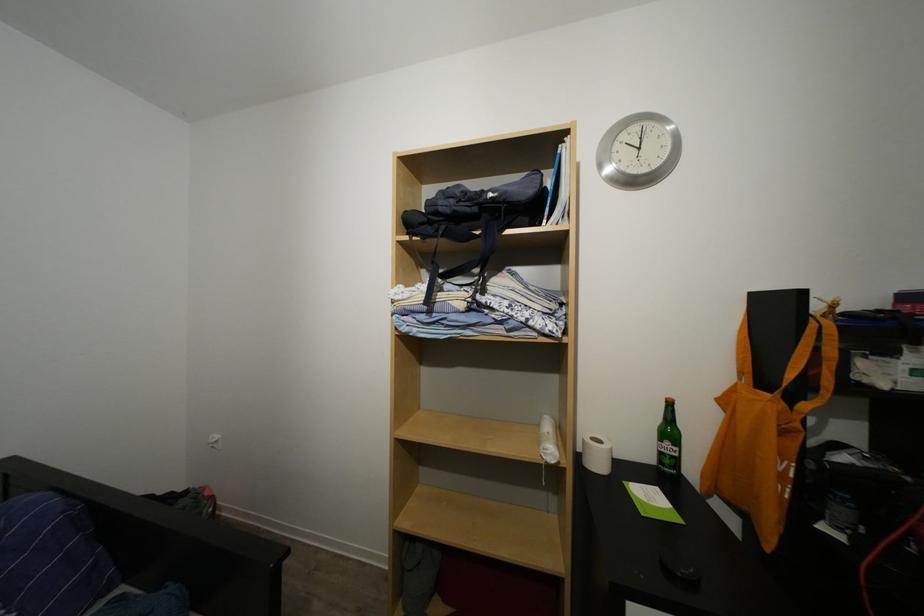
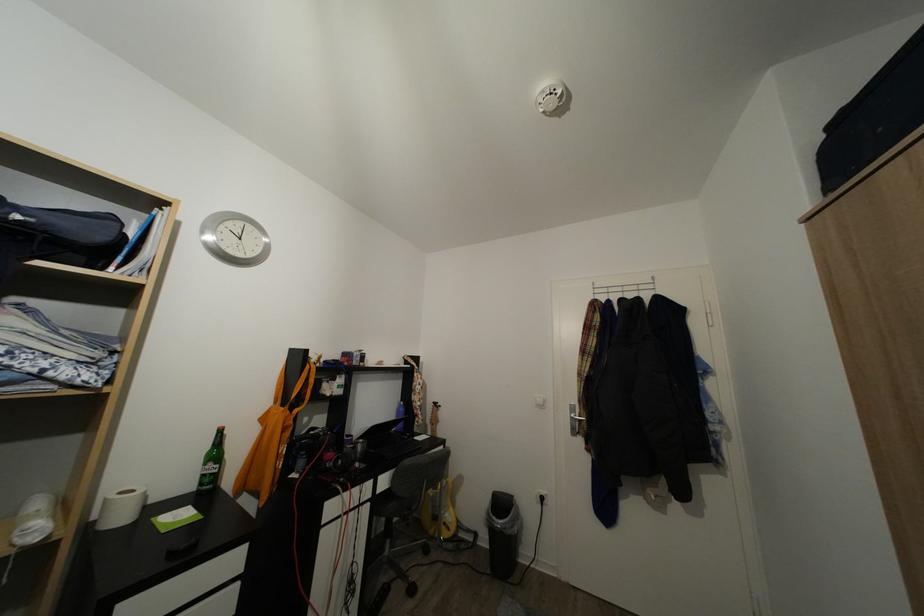
Where in the second image is the point corresponding to point (601, 446) from the first image?

(129, 500)